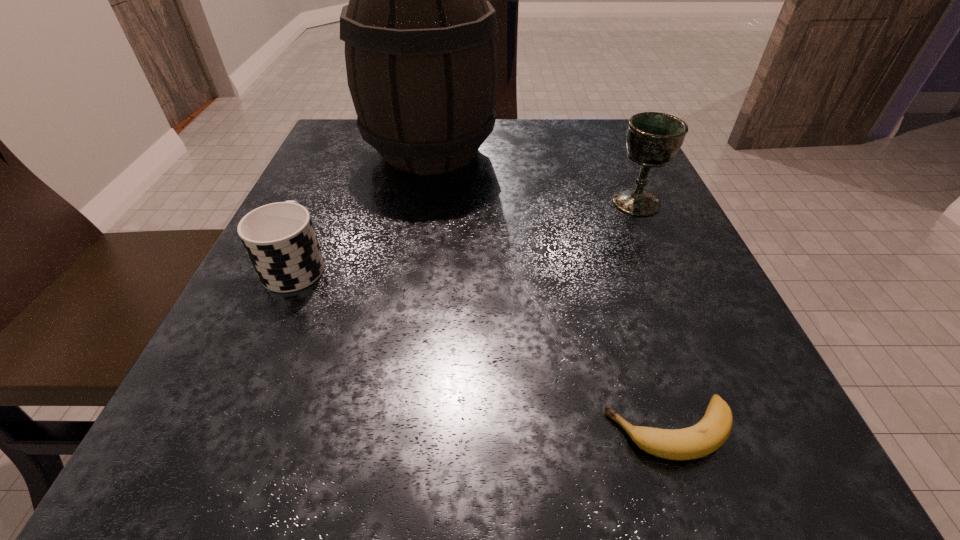
Identify the location of object located in the far left corner section of the desktop. This screenshot has height=540, width=960. (421, 58).

Locate an element on the screen. The image size is (960, 540). object located at the near right corner is located at coordinates (710, 433).

Find the location of a particular element. Image resolution: width=960 pixels, height=540 pixels. blank space at the far edge of the desktop is located at coordinates (536, 129).

In the image, there is a desktop. Where is `vacant region at the near edge`? The width and height of the screenshot is (960, 540). vacant region at the near edge is located at coordinates (444, 498).

The height and width of the screenshot is (540, 960). In the image, there is a desktop. Identify the location of vacant space at the left edge. (292, 322).

Identify the location of free spot at the right edge of the desktop. This screenshot has height=540, width=960. (624, 327).

Locate an element on the screen. This screenshot has height=540, width=960. free region at the far left corner of the desktop is located at coordinates (322, 163).

This screenshot has width=960, height=540. Identify the location of vacant space at the far right corner of the desktop. (584, 126).

Locate an element on the screen. Image resolution: width=960 pixels, height=540 pixels. blank area at the near right corner is located at coordinates (827, 497).

Where is `free space between the second shortest object and the farthest object`? free space between the second shortest object and the farthest object is located at coordinates (363, 208).